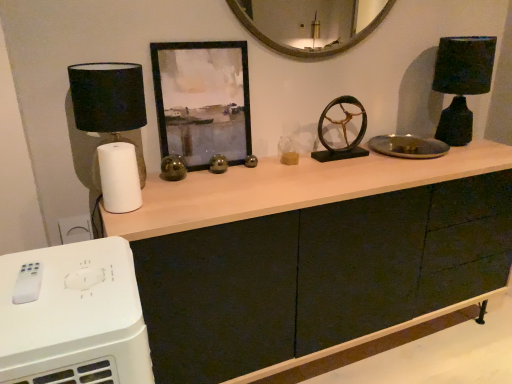
Find the location of a particular element. The height and width of the screenshot is (384, 512). free location to the right of matte black lampshade at left, positioned as the 2th table lamp in right-to-left order is located at coordinates (182, 192).